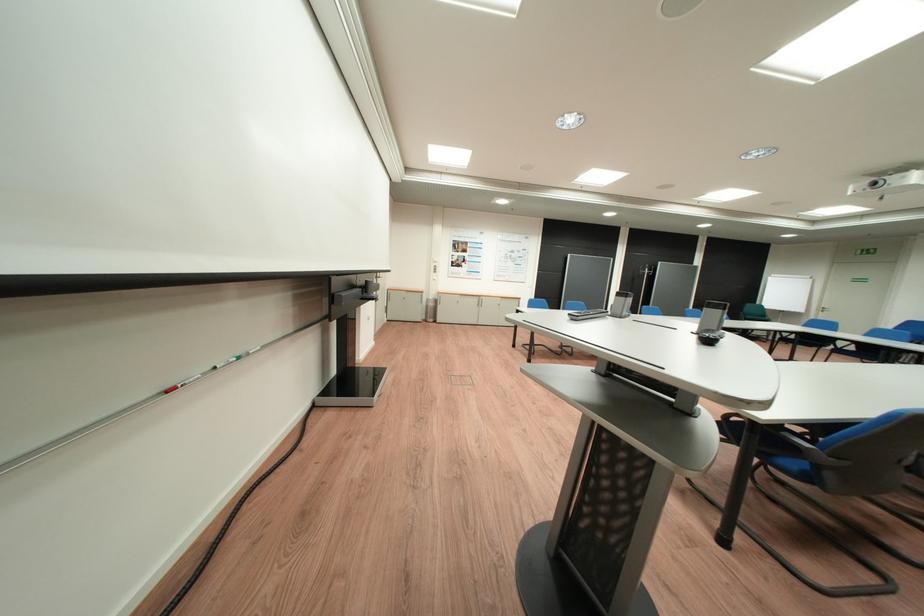
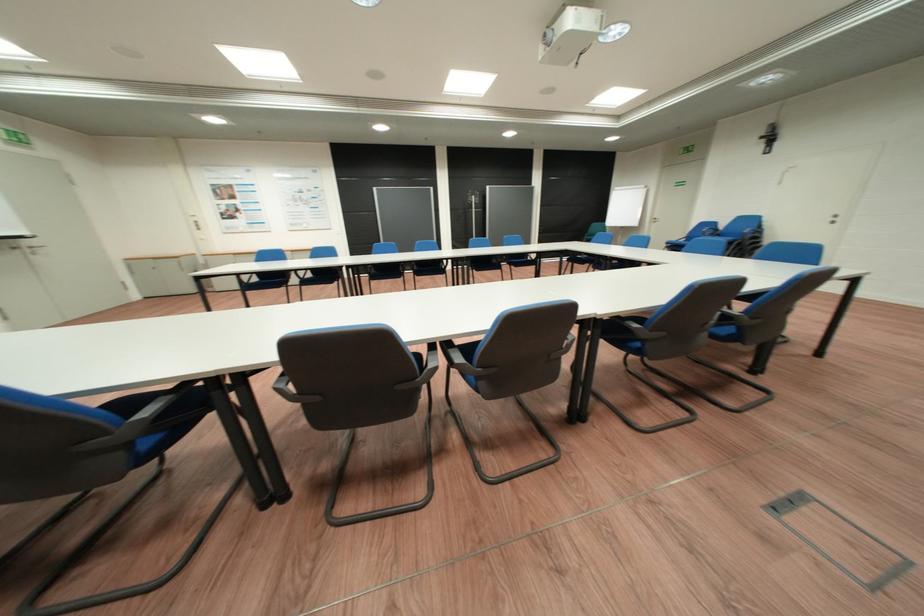
Question: I am providing you with two images of the same scene from different viewpoints. Please identify which objects are invisible in image2.

Choices:
 (A) blue chair sitting surface
 (B) black remote control
 (C) door push bar
 (D) stainless steel tumbler

Answer: (B)